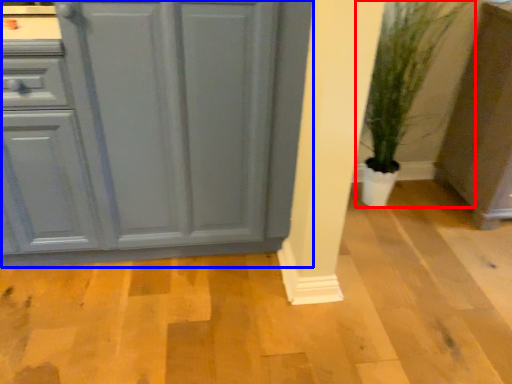
Question: Which point is further to the camera, houseplant (highlighted by a red box) or cabinetry (highlighted by a blue box)?

Choices:
 (A) houseplant
 (B) cabinetry

Answer: (A)